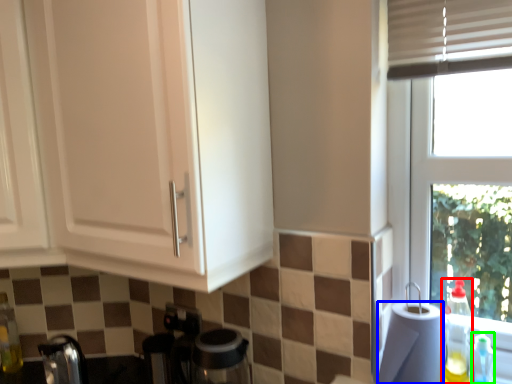
Question: Which is nearer to the bottle (highlighted by a red box)? paper towel (highlighted by a blue box) or bottle (highlighted by a green box).

Choices:
 (A) paper towel
 (B) bottle

Answer: (B)